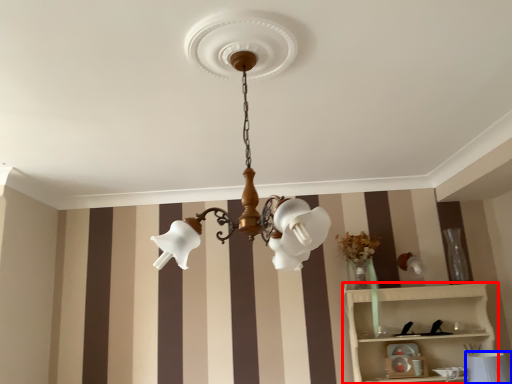
Question: Which object appears closest to the camera in this image, shelf (highlighted by a red box) or table lamp (highlighted by a blue box)?

Choices:
 (A) shelf
 (B) table lamp

Answer: (B)